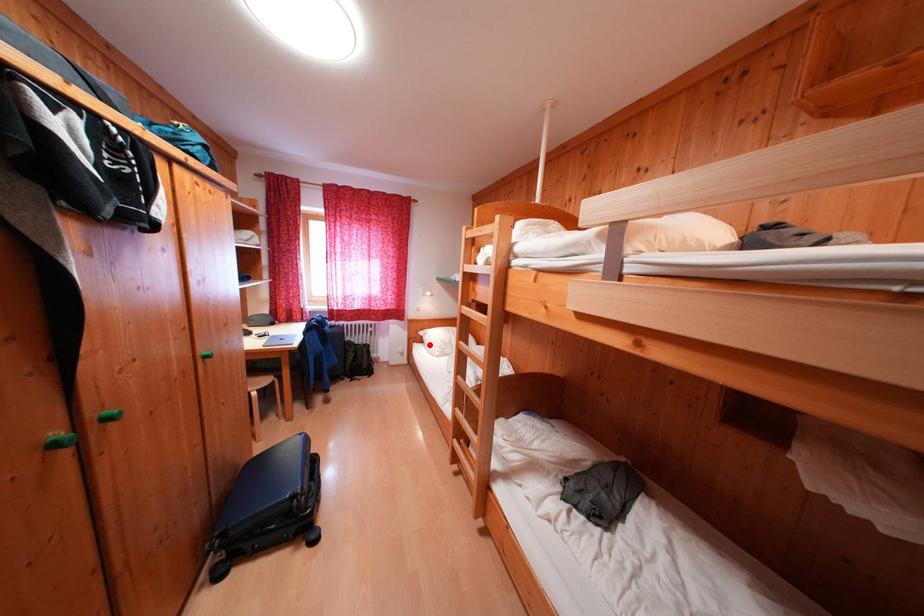
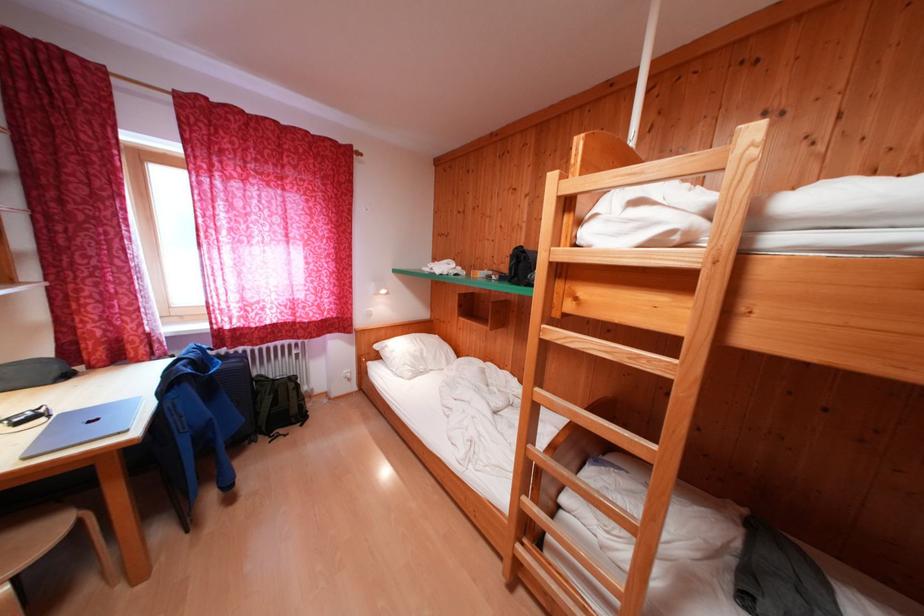
Question: A red point is marked in image1. In image2, is the corresponding 3D point closer to the camera or farther? Reply with the corresponding letter.

Choices:
 (A) The corresponding 3D point is closer.
 (B) The corresponding 3D point is farther.

Answer: (A)